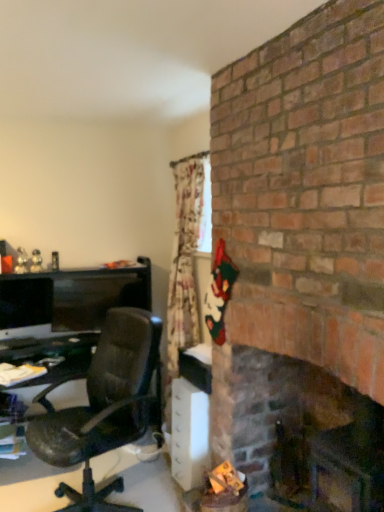
Question: Visually, is white plastic/file cabinet at lower center positioned to the left or to the right of matte black monitor at left?

Choices:
 (A) right
 (B) left

Answer: (A)

Question: In terms of width, does white plastic/file cabinet at lower center look wider or thinner when compared to matte black monitor at left?

Choices:
 (A) wide
 (B) thin

Answer: (A)

Question: Based on their relative distances, which object is nearer to the dark brown wood fireplace at right?

Choices:
 (A) matte black monitor at left
 (B) white plastic/file cabinet at lower center

Answer: (B)

Question: Which object is the closest to the white plastic/file cabinet at lower center?

Choices:
 (A) matte black monitor at left
 (B) dark brown wood fireplace at right

Answer: (B)